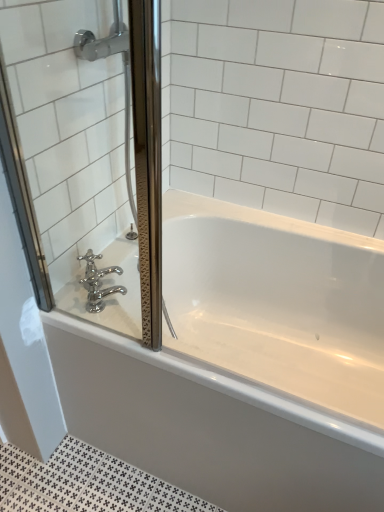
Question: From a real-world perspective, is clear glass screen door at left over polished chrome faucet at lower left?

Choices:
 (A) yes
 (B) no

Answer: (A)

Question: Is clear glass screen door at left outside polished chrome faucet at lower left?

Choices:
 (A) no
 (B) yes

Answer: (B)

Question: Is clear glass screen door at left next to polished chrome faucet at lower left?

Choices:
 (A) yes
 (B) no

Answer: (B)

Question: Considering the relative positions of clear glass screen door at left and polished chrome faucet at lower left in the image provided, is clear glass screen door at left to the left of polished chrome faucet at lower left from the viewer's perspective?

Choices:
 (A) yes
 (B) no

Answer: (B)

Question: Is polished chrome faucet at lower left a part of clear glass screen door at left?

Choices:
 (A) yes
 (B) no

Answer: (A)

Question: From a real-world perspective, is white glossy bathtub at center above or below polished chrome faucet at lower left?

Choices:
 (A) above
 (B) below

Answer: (B)

Question: Which is correct: white glossy bathtub at center is inside polished chrome faucet at lower left, or outside of it?

Choices:
 (A) inside
 (B) outside

Answer: (B)

Question: Considering the positions of point (97, 422) and point (92, 262), is point (97, 422) closer or farther from the camera than point (92, 262)?

Choices:
 (A) farther
 (B) closer

Answer: (A)

Question: Considering the positions of white glossy bathtub at center and polished chrome faucet at lower left in the image, is white glossy bathtub at center taller or shorter than polished chrome faucet at lower left?

Choices:
 (A) tall
 (B) short

Answer: (A)

Question: Looking at their shapes, would you say clear glass screen door at left is wider or thinner than polished chrome faucet at lower left?

Choices:
 (A) wide
 (B) thin

Answer: (A)

Question: In terms of size, does clear glass screen door at left appear bigger or smaller than polished chrome faucet at lower left?

Choices:
 (A) big
 (B) small

Answer: (A)

Question: Visually, is clear glass screen door at left positioned to the left or to the right of polished chrome faucet at lower left?

Choices:
 (A) right
 (B) left

Answer: (A)

Question: Relative to polished chrome faucet at lower left, is clear glass screen door at left in front or behind?

Choices:
 (A) behind
 (B) front

Answer: (B)

Question: Is clear glass screen door at left in front of or behind white glossy bathtub at center in the image?

Choices:
 (A) behind
 (B) front

Answer: (B)

Question: Based on their positions, is clear glass screen door at left located to the left or right of white glossy bathtub at center?

Choices:
 (A) right
 (B) left

Answer: (B)